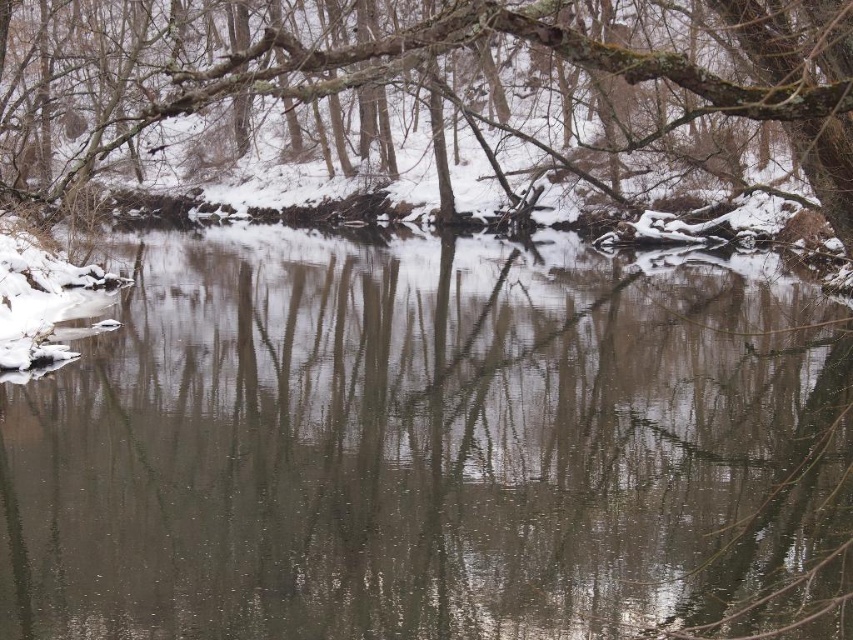
You are an observer standing at the edge of the river. You see the clear water at center and the smooth bark tree at upper center. Which object is located to the right side of the other?

The clear water at center is to the right of the smooth bark tree at upper center.

Looking at this image, you are an observer standing at the edge of the river. You notice the clear water at center and the smooth bark tree at upper center. Which object is closer to your viewpoint?

The clear water at center is closer to the viewer than the smooth bark tree at upper center.